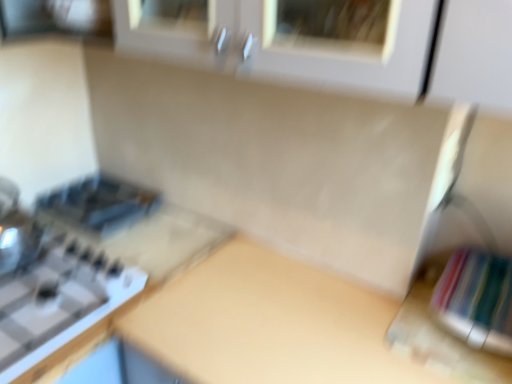
Question: Is beige matte counter top at center closer to the viewer compared to satin black toaster at left?

Choices:
 (A) no
 (B) yes

Answer: (B)

Question: Does beige matte counter top at center appear on the left side of satin black toaster at left?

Choices:
 (A) no
 (B) yes

Answer: (A)

Question: Can you confirm if beige matte counter top at center is wider than satin black toaster at left?

Choices:
 (A) no
 (B) yes

Answer: (B)

Question: From a real-world perspective, does beige matte counter top at center sit lower than satin black toaster at left?

Choices:
 (A) no
 (B) yes

Answer: (B)

Question: Does beige matte counter top at center have a greater height compared to satin black toaster at left?

Choices:
 (A) yes
 (B) no

Answer: (A)

Question: In terms of height, does white glossy gas stove at left look taller or shorter compared to beige matte counter top at center?

Choices:
 (A) short
 (B) tall

Answer: (A)

Question: Looking at the image, does white glossy gas stove at left seem bigger or smaller compared to beige matte counter top at center?

Choices:
 (A) small
 (B) big

Answer: (A)

Question: Does point (93, 264) appear closer or farther from the camera than point (253, 276)?

Choices:
 (A) farther
 (B) closer

Answer: (A)

Question: Looking at their shapes, would you say white glossy gas stove at left is wider or thinner than beige matte counter top at center?

Choices:
 (A) wide
 (B) thin

Answer: (B)

Question: Is white glossy gas stove at left spatially inside satin black toaster at left, or outside of it?

Choices:
 (A) outside
 (B) inside

Answer: (A)

Question: Is point (24, 372) closer or farther from the camera than point (53, 215)?

Choices:
 (A) farther
 (B) closer

Answer: (B)

Question: In terms of width, does white glossy gas stove at left look wider or thinner when compared to satin black toaster at left?

Choices:
 (A) wide
 (B) thin

Answer: (A)

Question: In the image, is white glossy gas stove at left positioned in front of or behind satin black toaster at left?

Choices:
 (A) front
 (B) behind

Answer: (A)

Question: Considering the positions of point (304, 372) and point (135, 201), is point (304, 372) closer or farther from the camera than point (135, 201)?

Choices:
 (A) farther
 (B) closer

Answer: (B)

Question: Is beige matte counter top at center wider or thinner than satin black toaster at left?

Choices:
 (A) thin
 (B) wide

Answer: (B)